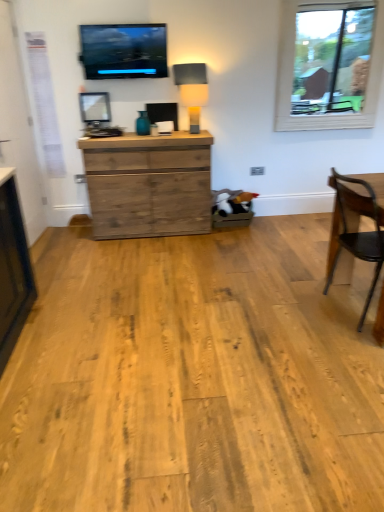
The width and height of the screenshot is (384, 512). What do you see at coordinates (123, 51) in the screenshot?
I see `matte black screen at upper center` at bounding box center [123, 51].

This screenshot has height=512, width=384. I want to click on rustic wood chest of drawers at center, so click(148, 184).

Find the location of a particular element. clear glass window at upper right is located at coordinates (x=329, y=64).

From the image's perspective, between rustic wood chest of drawers at center and clear glass window at upper right, who is located below?

rustic wood chest of drawers at center.

Between rustic wood chest of drawers at center and clear glass window at upper right, which one is positioned behind?

Positioned behind is clear glass window at upper right.

Is rustic wood chest of drawers at center shorter than clear glass window at upper right?

Indeed, rustic wood chest of drawers at center has a lesser height compared to clear glass window at upper right.

Is matte black screen at upper center positioned far away from rustic wood chest of drawers at center?

No, matte black screen at upper center is in close proximity to rustic wood chest of drawers at center.

This screenshot has width=384, height=512. In order to click on television above the rustic wood chest of drawers at center (from the image's perspective) in this screenshot , I will do `click(123, 51)`.

Do you think matte black screen at upper center is within rustic wood chest of drawers at center, or outside of it?

matte black screen at upper center is outside rustic wood chest of drawers at center.

Considering their positions, is matte black screen at upper center located in front of or behind rustic wood chest of drawers at center?

Visually, matte black screen at upper center is located in front of rustic wood chest of drawers at center.

From a real-world perspective, is matte black screen at upper center positioned above or below matte beige lampshade at center?

matte black screen at upper center is above matte beige lampshade at center.

Looking at the image, does matte black screen at upper center seem bigger or smaller compared to matte beige lampshade at center?

Considering their sizes, matte black screen at upper center takes up more space than matte beige lampshade at center.

Can you confirm if matte black screen at upper center is taller than matte beige lampshade at center?

Indeed, matte black screen at upper center has a greater height compared to matte beige lampshade at center.

Would you say matte black screen at upper center is outside matte beige lampshade at center?

Yes.

Which object is more forward, matte beige lampshade at center or rustic wood chest of drawers at center?

rustic wood chest of drawers at center is more forward.

Is point (199, 125) less distant than point (114, 144)?

No, (199, 125) is behind (114, 144).

From the image's perspective, relative to rustic wood chest of drawers at center, is matte beige lampshade at center above or below?

From the image's perspective, matte beige lampshade at center appears above rustic wood chest of drawers at center.

From the image's perspective, which is above, matte beige lampshade at center or clear glass window at upper right?

From the image's view, clear glass window at upper right is above.

Does matte beige lampshade at center have a larger size compared to clear glass window at upper right?

No.

Is matte beige lampshade at center further to the viewer compared to clear glass window at upper right?

No, it is not.

Based on the photo, what's the angular difference between matte beige lampshade at center and clear glass window at upper right's facing directions?

There is a 2.27-degree angle between the facing directions of matte beige lampshade at center and clear glass window at upper right.

Can you confirm if rustic wood chest of drawers at center is shorter than wooden chair at right?

Yes, rustic wood chest of drawers at center is shorter than wooden chair at right.

Can we say rustic wood chest of drawers at center lies outside wooden chair at right?

Yes, rustic wood chest of drawers at center is outside of wooden chair at right.

Is rustic wood chest of drawers at center directly adjacent to wooden chair at right?

No, rustic wood chest of drawers at center is not touching wooden chair at right.

From the image's perspective, which is below, wooden chair at right or clear glass window at upper right?

From the image's view, wooden chair at right is below.

Considering the relative positions of wooden chair at right and clear glass window at upper right in the image provided, is wooden chair at right to the left or to the right of clear glass window at upper right?

From the image, it's evident that wooden chair at right is to the left of clear glass window at upper right.

Looking at this image, which is correct: wooden chair at right is inside clear glass window at upper right, or outside of it?

wooden chair at right is not enclosed by clear glass window at upper right.

Where is `window above the rustic wood chest of drawers at center (from a real-world perspective)`? The height and width of the screenshot is (512, 384). window above the rustic wood chest of drawers at center (from a real-world perspective) is located at coordinates (329, 64).

Where is `chest of drawers located on the right of matte black screen at upper center`? chest of drawers located on the right of matte black screen at upper center is located at coordinates (148, 184).

Based on their spatial positions, is wooden chair at right or matte beige lampshade at center further from rustic wood chest of drawers at center?

wooden chair at right lies further to rustic wood chest of drawers at center than the other object.

When comparing their distances from wooden chair at right, does matte black screen at upper center or clear glass window at upper right seem closer?

clear glass window at upper right.

Looking at the image, which one is located closer to matte beige lampshade at center, matte black screen at upper center or rustic wood chest of drawers at center?

matte black screen at upper center.

Based on their spatial positions, is wooden chair at right or rustic wood chest of drawers at center further from matte black screen at upper center?

wooden chair at right lies further to matte black screen at upper center than the other object.

From the image, which object appears to be farther from wooden chair at right, rustic wood chest of drawers at center or clear glass window at upper right?

Based on the image, clear glass window at upper right appears to be further to wooden chair at right.

Looking at this image, based on their spatial positions, is matte black screen at upper center or wooden chair at right further from matte beige lampshade at center?

Among the two, wooden chair at right is located further to matte beige lampshade at center.

From the picture: Which object lies nearer to the anchor point wooden chair at right, matte beige lampshade at center or matte black screen at upper center?

matte beige lampshade at center is positioned closer to the anchor wooden chair at right.

Looking at the image, which one is located further to rustic wood chest of drawers at center, matte black screen at upper center or wooden chair at right?

wooden chair at right is further to rustic wood chest of drawers at center.

Where is `lamp between matte black screen at upper center and rustic wood chest of drawers at center from top to bottom`? lamp between matte black screen at upper center and rustic wood chest of drawers at center from top to bottom is located at coordinates (192, 90).

The image size is (384, 512). Find the location of `lamp located between rustic wood chest of drawers at center and clear glass window at upper right in the left-right direction`. lamp located between rustic wood chest of drawers at center and clear glass window at upper right in the left-right direction is located at coordinates coord(192,90).

The width and height of the screenshot is (384, 512). What are the coordinates of `lamp between matte black screen at upper center and wooden chair at right from top to bottom` in the screenshot? It's located at (192, 90).

Identify the location of lamp between clear glass window at upper right and wooden chair at right from top to bottom. (192, 90).